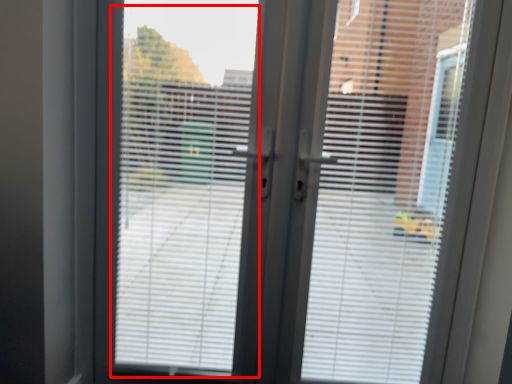
Question: Where is window screen (annotated by the red box) located in relation to blind in the image?

Choices:
 (A) left
 (B) right

Answer: (A)